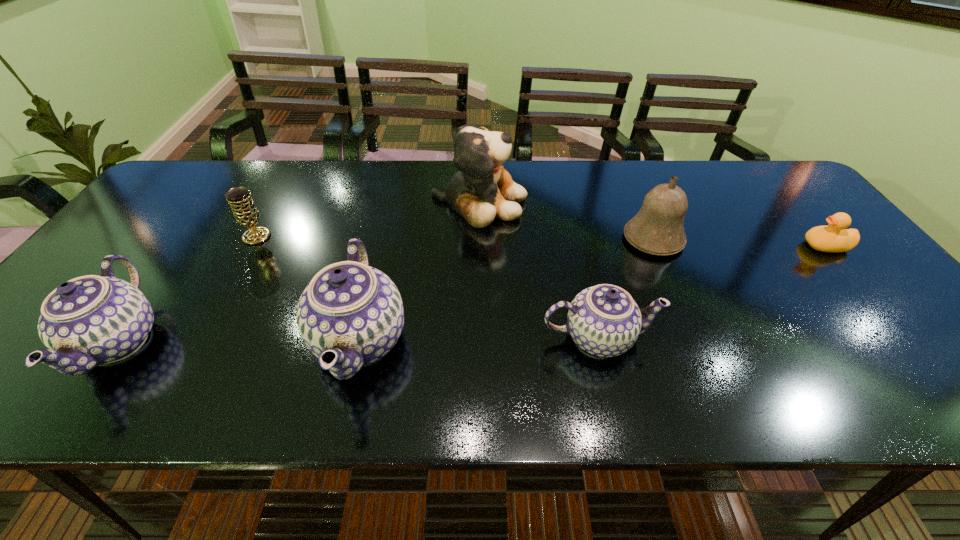
You are a GUI agent. You are given a task and a screenshot of the screen. Output one action in this format:
    pyautogui.click(x=<x>, y=<y>)
    Task: Click on the second tallest chinaware
    The height and width of the screenshot is (540, 960).
    Given the screenshot: What is the action you would take?
    pyautogui.click(x=87, y=321)

Find the location of `the leftmost chinaware`. the leftmost chinaware is located at coordinates (87, 321).

The image size is (960, 540). In order to click on the third object from left to right in this screenshot , I will do pyautogui.click(x=349, y=308).

This screenshot has width=960, height=540. Identify the location of the shortest chinaware. (604, 320).

Locate an element on the screen. the second object from left to right is located at coordinates tap(244, 209).

Find the location of a particular element. The height and width of the screenshot is (540, 960). puppy is located at coordinates (482, 189).

I want to click on bell, so click(x=658, y=228).

You are a GUI agent. You are given a task and a screenshot of the screen. Output one action in this format:
    pyautogui.click(x=<x>, y=<y>)
    Task: Click on the rightmost object
    
    Given the screenshot: What is the action you would take?
    pyautogui.click(x=834, y=238)

Identify the location of the shortest object. The height and width of the screenshot is (540, 960). (834, 238).

Identify the location of free space located at the spout of the second shortest chinaware. (54, 342).